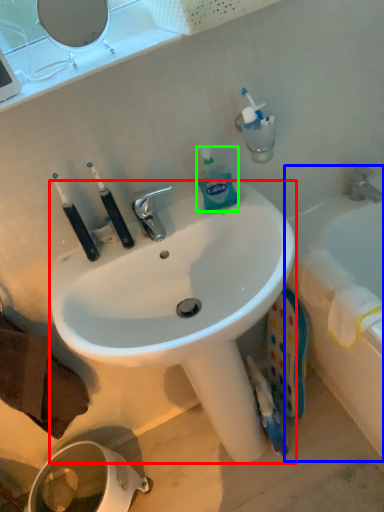
Question: Which is nearer to the sink (highlighted by a red box)? bathtub (highlighted by a blue box) or bottle (highlighted by a green box).

Choices:
 (A) bathtub
 (B) bottle

Answer: (B)